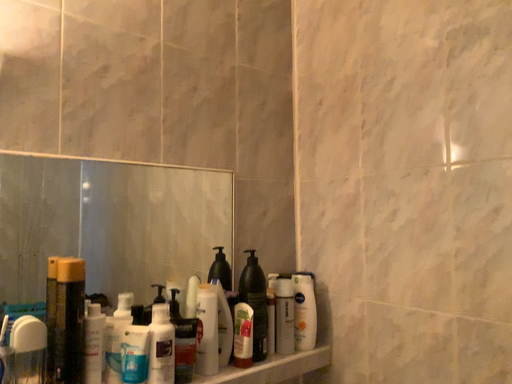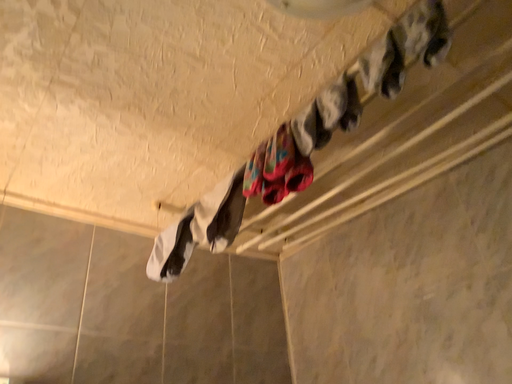
Question: Which way did the camera rotate in the video?

Choices:
 (A) rotated downward
 (B) rotated upward

Answer: (B)